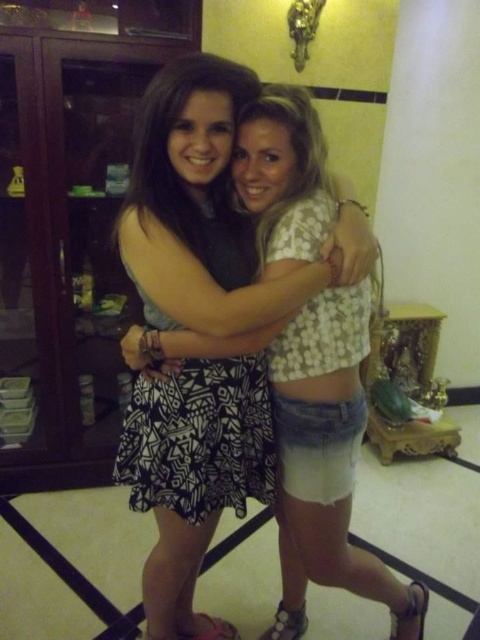
Which of these two, white printed dress at center or white geometric-patterned dress at center, stands shorter?

white geometric-patterned dress at center is shorter.

Can you confirm if white printed dress at center is positioned below white geometric-patterned dress at center?

Yes, white printed dress at center is below white geometric-patterned dress at center.

Does point (303, 326) lie behind point (250, 257)?

No, (303, 326) is in front of (250, 257).

Locate an element on the screen. This screenshot has width=480, height=640. white printed dress at center is located at coordinates (326, 464).